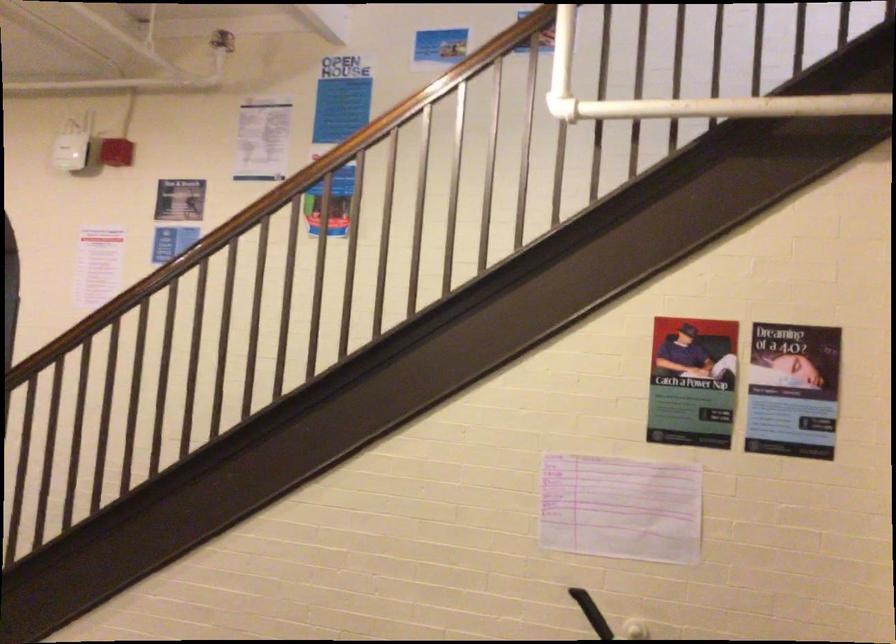
You are a GUI agent. You are given a task and a screenshot of the screen. Output one action in this format:
    pyautogui.click(x=<x>, y=<y>)
    Task: Click on the wooden stair handrail
    This screenshot has width=896, height=644.
    Given the screenshot: What is the action you would take?
    pyautogui.click(x=276, y=198)